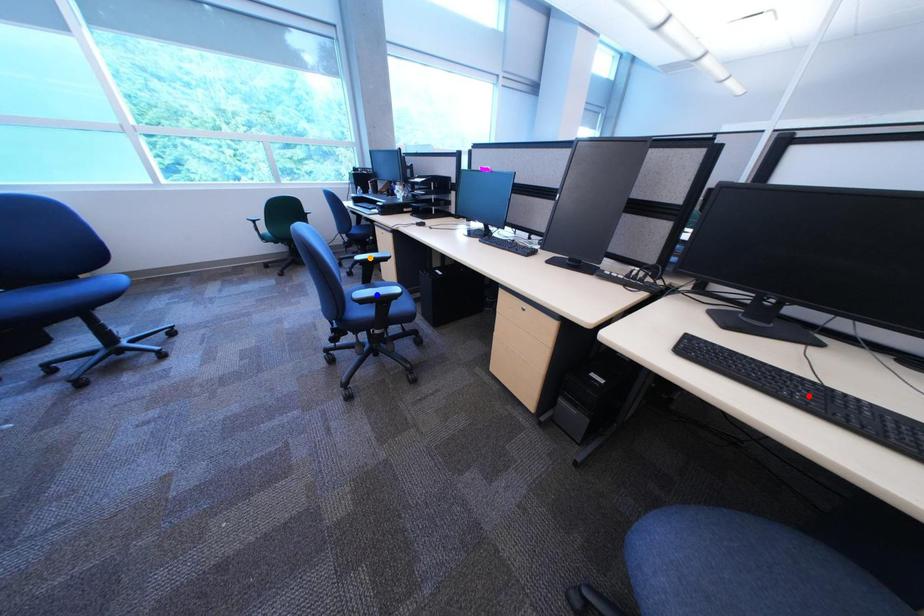
Order these from nearest to farthest:
blue point | red point | orange point

orange point → blue point → red point